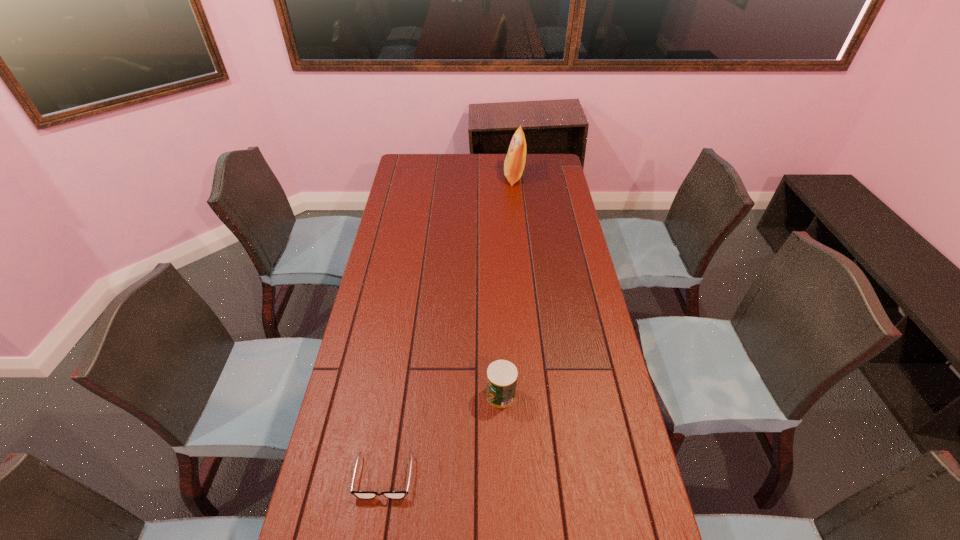
This screenshot has height=540, width=960. I want to click on object situated at the far edge, so click(514, 163).

Where is `object that is at the left edge`? object that is at the left edge is located at coordinates (359, 494).

Find the location of `free region at the far edge of the desktop`. free region at the far edge of the desktop is located at coordinates (478, 160).

Where is `vacant region at the left edge`? Image resolution: width=960 pixels, height=540 pixels. vacant region at the left edge is located at coordinates (421, 235).

In the image, there is a desktop. Where is `free region at the right edge`? free region at the right edge is located at coordinates (588, 288).

In the image, there is a desktop. At what (x,y) coordinates should I click in order to perform the action: click on vacant space at the far left corner. Please return your answer as a coordinate pair (x, y). The image size is (960, 540). Looking at the image, I should click on (422, 165).

This screenshot has width=960, height=540. What are the coordinates of `vacant space that's between the tallest object and the shortest object` in the screenshot? It's located at pos(449,327).

At what (x,y) coordinates should I click in order to perform the action: click on blank region between the can and the crisp (potato chip). Please return your answer as a coordinate pair (x, y). Image resolution: width=960 pixels, height=540 pixels. Looking at the image, I should click on (508, 286).

Locate an element on the screen. free space between the spectacles and the rightmost object is located at coordinates (449, 327).

I want to click on vacant point located between the can and the nearest object, so (x=443, y=436).